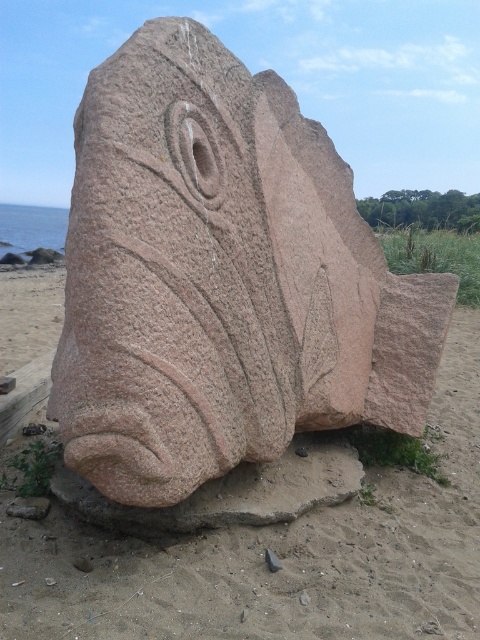
You are an art student examining two sculptures on a beach. You notice the pink granite fish at center and the pink stone fish at center. Which one appears closer to you?

The pink granite fish at center appears closer because it is in front of the pink stone fish at center.

You are standing on the beach looking at the stone fish sculpture. There are two points marked on the sculpture, one at point coordinate (136, 435) and another at point coordinate (162, 552). Which point is closer to you?

Point coordinate (136, 435) is closer to you than point coordinate (162, 552).

You are an art student analyzing the sculpture. You notice two fish sculptures labeled as pink granite fish at center and pink stone fish at center. According to the scene description, which fish is positioned to the right of the other?

The pink granite fish at center is positioned to the right of the pink stone fish at center.